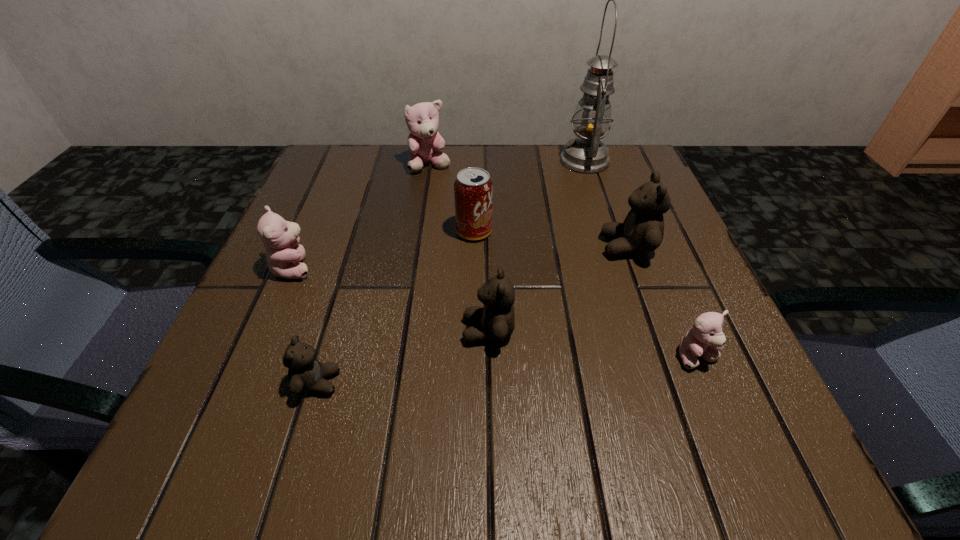
Image resolution: width=960 pixels, height=540 pixels. Identify the location of gray oil lamp. (586, 154).

The width and height of the screenshot is (960, 540). I want to click on the tallest object, so click(x=586, y=154).

Identify the location of the farthest teddy bear. This screenshot has height=540, width=960. (424, 141).

Where is `the second pink teddy bear from left to right`? The width and height of the screenshot is (960, 540). the second pink teddy bear from left to right is located at coordinates (424, 141).

Identify the location of the farthest brown teddy bear. The image size is (960, 540). (642, 231).

This screenshot has width=960, height=540. In order to click on the rightmost brown teddy bear in this screenshot , I will do `click(642, 231)`.

Locate an element on the screen. red soda can is located at coordinates (473, 189).

Find the location of `the second smallest brown teddy bear`. the second smallest brown teddy bear is located at coordinates (495, 321).

Locate an element on the screen. The height and width of the screenshot is (540, 960). the second farthest brown teddy bear is located at coordinates (495, 321).

At what (x,y) coordinates should I click in order to perform the action: click on the second biggest pink teddy bear. Please return your answer as a coordinate pair (x, y). The image size is (960, 540). Looking at the image, I should click on (280, 237).